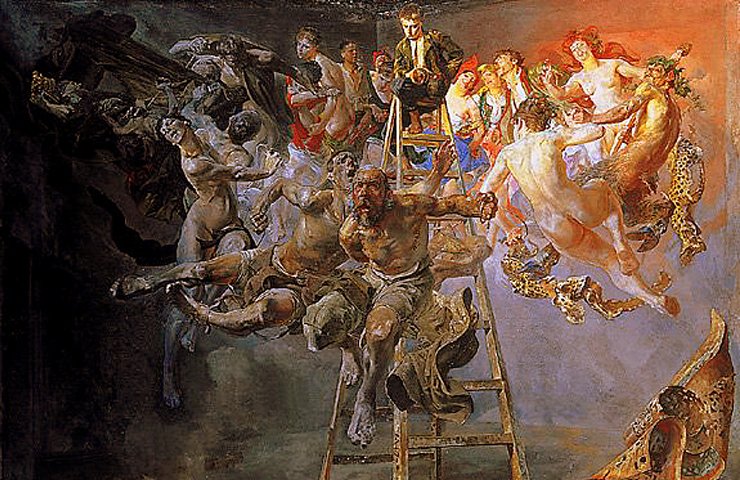
Where is `ladder`? The width and height of the screenshot is (740, 480). ladder is located at coordinates coord(397,460).